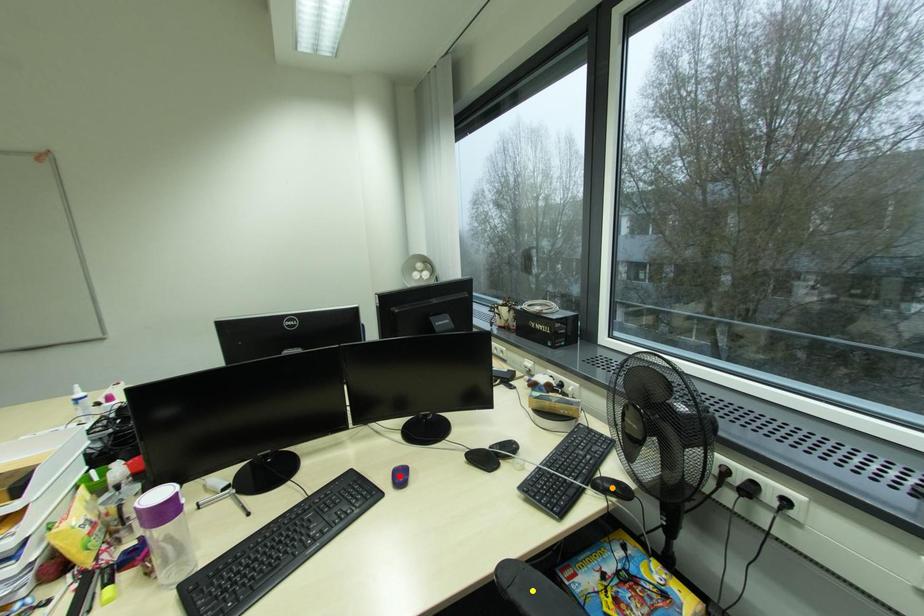
Order these from farthest to nearest:
- orange point
- yellow point
- red point

red point < orange point < yellow point